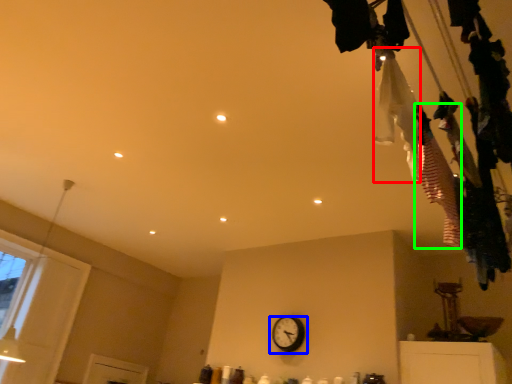
Question: Which is nearer to the clothing (highlighted by a red box)? wall clock (highlighted by a blue box) or clothing (highlighted by a green box).

Choices:
 (A) wall clock
 (B) clothing

Answer: (B)